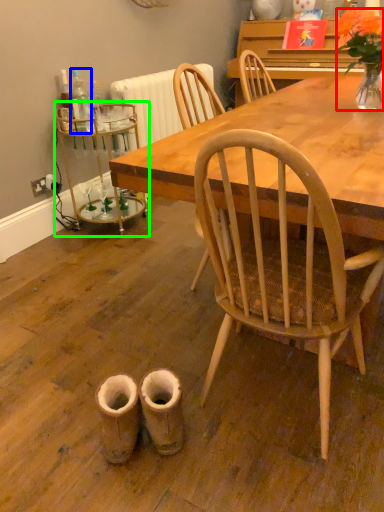
Question: Considering the real-world distances, which object is farthest from houseplant (highlighted by a red box)? bottle (highlighted by a blue box) or side table (highlighted by a green box)?

Choices:
 (A) bottle
 (B) side table

Answer: (B)